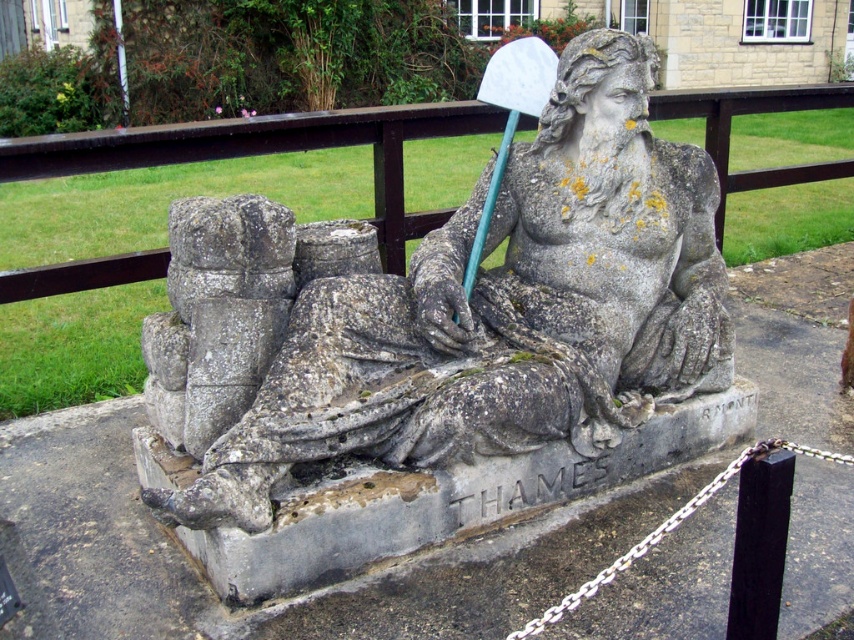
You are a photographer trying to capture the statue of the river deity. You notice two points on the statue marked at coordinates point (714, 275) and point (509, 113). Which of these points is nearer to your camera lens when taking the photo?

Point (714, 275) is closer to the camera than point (509, 113), so it will appear nearer in the photograph.

You are a surveyor tasked with mapping the coordinates of landmarks in a park. You observe the stone statue at center in the image. What are its coordinates?

The stone statue at center is located at point (502, 310).

You are standing at the point with coordinates (502,310) in the image. What object are you directly facing?

The point at (502,310) corresponds to the stone statue at center, so you are directly facing the stone statue at center.